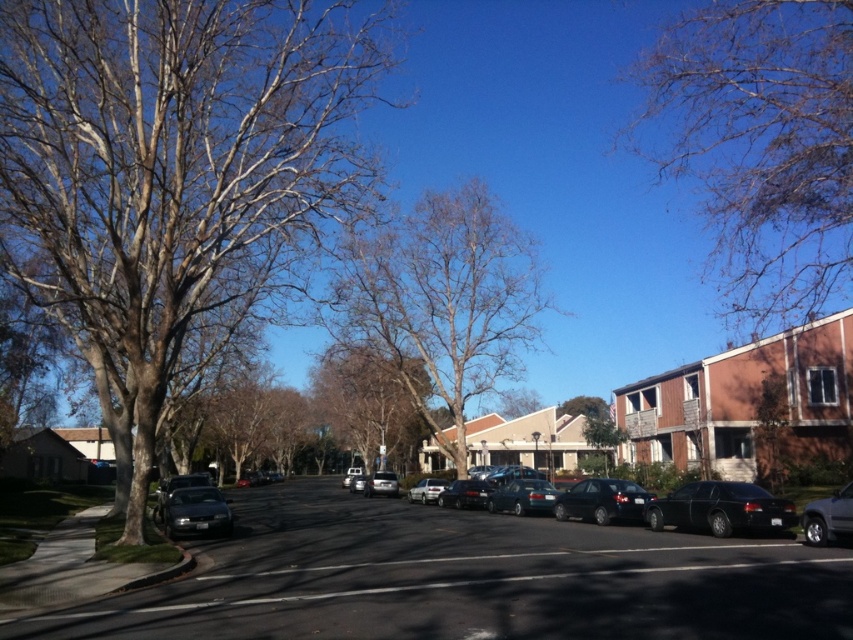
Does glossy black sedan at right appear over glossy black sedan at center?

Correct, glossy black sedan at right is located above glossy black sedan at center.

From the picture: Which is below, glossy black sedan at right or glossy black sedan at center?

Positioned lower is glossy black sedan at center.

Which is in front, point (717, 481) or point (616, 509)?

Point (717, 481) is more forward.

The image size is (853, 640). I want to click on glossy black sedan at right, so click(720, 508).

This screenshot has width=853, height=640. What do you see at coordinates (523, 497) in the screenshot?
I see `metallic teal sedan at center` at bounding box center [523, 497].

Which is below, metallic teal sedan at center or satin black sedan at center?

metallic teal sedan at center

At what (x,y) coordinates should I click in order to perform the action: click on metallic teal sedan at center. Please return your answer as a coordinate pair (x, y). Looking at the image, I should click on (523, 497).

Is the position of bare branches at upper right less distant than that of satin black sedan at center?

Yes.

Does bare branches at upper right have a lesser width compared to satin black sedan at center?

No, bare branches at upper right is not thinner than satin black sedan at center.

Is point (782, 115) positioned before point (451, 496)?

Yes.

This screenshot has height=640, width=853. Identify the location of bare branches at upper right. (762, 145).